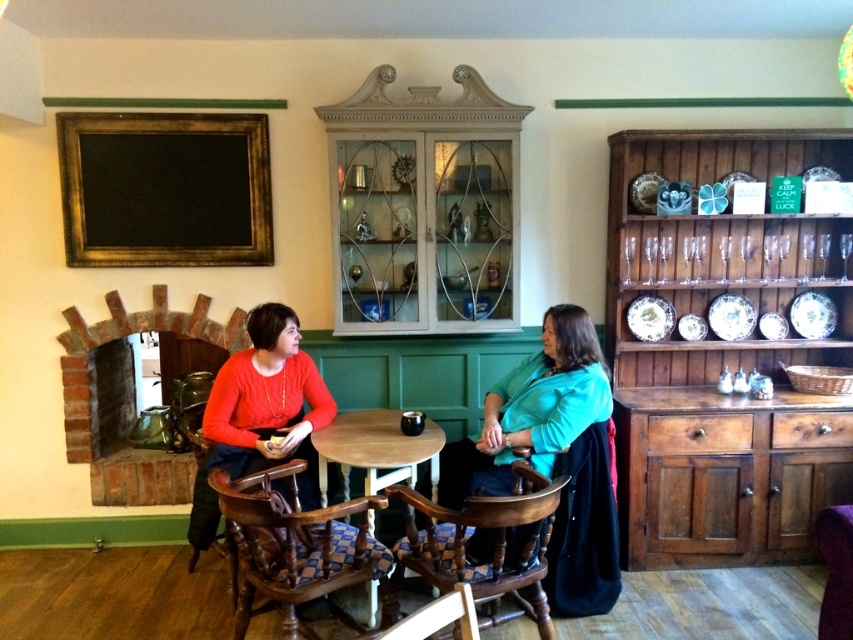
You are designing a layout for a small apartment and need to place a sofa that is 1.2 meters wide. You have a space that can accommodate an object with a width of 1 meter. You see the wooden polished chair at center and the matte red sweater at center in the scene. Which object can fit into the 1 meter width space?

The wooden polished chair at center has a lesser width compared to the matte red sweater at center, so the wooden polished chair at center can fit into the 1 meter width space since it is narrower.

You are standing at the entrance of the cafe and want to sit at the light brown wooden table at center. Which direction should you walk to reach it?

The light brown wooden table at center is located at point 0.705 on the x and 0.442 on the y. Since you are at the entrance, you should walk towards the center of the image to reach the table.